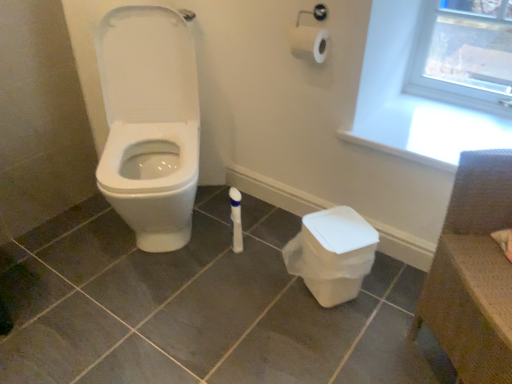
You are a GUI agent. You are given a task and a screenshot of the screen. Output one action in this format:
    pyautogui.click(x=<x>, y=<y>)
    Task: Click on the brown woven chair at upper right
    The height and width of the screenshot is (384, 512).
    Given the screenshot: What is the action you would take?
    pyautogui.click(x=473, y=273)

Measure the distance between point (331,292) and camera.

The depth of point (331,292) is 4.63 feet.

The image size is (512, 384). Describe the element at coordinates (332, 254) in the screenshot. I see `white plastic potty at lower right` at that location.

Describe the element at coordinates (464, 55) in the screenshot. I see `white plastic window frame at upper right` at that location.

The height and width of the screenshot is (384, 512). Identify the location of brown woven chair at upper right. (473, 273).

From the image's perspective, is white plastic window frame at upper right located above or below brown woven chair at upper right?

From the image's perspective, white plastic window frame at upper right appears above brown woven chair at upper right.

Measure the distance between white plastic window frame at upper right and brown woven chair at upper right.

white plastic window frame at upper right is 36.42 inches from brown woven chair at upper right.

Is white plastic window frame at upper right placed right next to brown woven chair at upper right?

No, white plastic window frame at upper right is not making contact with brown woven chair at upper right.

From a real-world perspective, is white plastic window frame at upper right beneath brown woven chair at upper right?

Actually, white plastic window frame at upper right is physically above brown woven chair at upper right in the real world.

Is point (455, 316) closer or farther from the camera than point (347, 293)?

Clearly, point (455, 316) is closer to the camera than point (347, 293).

Is brown woven chair at upper right wider or thinner than white plastic potty at lower right?

Considering their sizes, brown woven chair at upper right looks broader than white plastic potty at lower right.

Is brown woven chair at upper right spatially inside white plastic potty at lower right, or outside of it?

The correct answer is: outside.

From a real-world perspective, which is physically below, brown woven chair at upper right or white plastic potty at lower right?

From a 3D spatial view, white plastic potty at lower right is below.

Is white plastic potty at lower right facing away from white plastic window frame at upper right?

No.

How many degrees apart are the facing directions of white plastic potty at lower right and white plastic window frame at upper right?

30 degrees separate the facing orientations of white plastic potty at lower right and white plastic window frame at upper right.

At what (x,y) coordinates should I click in order to perform the action: click on window frame that appears above the white plastic potty at lower right (from a real-world perspective). Please return your answer as a coordinate pair (x, y). Looking at the image, I should click on click(x=464, y=55).

From the image's perspective, which is above, white plastic potty at lower right or white plastic window frame at upper right?

From the image's view, white plastic window frame at upper right is above.

Is brown woven chair at upper right completely or partially outside of white plastic window frame at upper right?

Yes, brown woven chair at upper right is located beyond the bounds of white plastic window frame at upper right.

This screenshot has width=512, height=384. In order to click on window frame above the brown woven chair at upper right (from the image's perspective) in this screenshot , I will do `click(464, 55)`.

Measure the distance between brown woven chair at upper right and white plastic window frame at upper right.

brown woven chair at upper right is 92.51 centimeters away from white plastic window frame at upper right.

Considering the positions of objects brown woven chair at upper right and white plastic window frame at upper right in the image provided, who is more to the left, brown woven chair at upper right or white plastic window frame at upper right?

Positioned to the left is brown woven chair at upper right.

Is white plastic window frame at upper right behind white plastic potty at lower right?

Yes, it is behind white plastic potty at lower right.

Which object is thinner, white plastic window frame at upper right or white plastic potty at lower right?

white plastic window frame at upper right is thinner.

From their relative heights in the image, would you say white plastic window frame at upper right is taller or shorter than white plastic potty at lower right?

Clearly, white plastic window frame at upper right is taller compared to white plastic potty at lower right.

Could you measure the distance between white plastic window frame at upper right and white plastic potty at lower right?

white plastic window frame at upper right and white plastic potty at lower right are 34.14 inches apart from each other.

Does point (293, 269) lie behind point (460, 256)?

That is True.

Image resolution: width=512 pixels, height=384 pixels. What are the coordinates of `potty below the brown woven chair at upper right (from a real-world perspective)` in the screenshot? It's located at (332, 254).

Looking at this image, what's the angular difference between white plastic potty at lower right and brown woven chair at upper right's facing directions?

16.4 degrees separate the facing orientations of white plastic potty at lower right and brown woven chair at upper right.

Based on the photo, between white plastic potty at lower right and brown woven chair at upper right, which one appears on the left side from the viewer's perspective?

white plastic potty at lower right is more to the left.

Where is `window frame to the right of brown woven chair at upper right`? This screenshot has width=512, height=384. window frame to the right of brown woven chair at upper right is located at coordinates (464, 55).

Where is `potty beneath the brown woven chair at upper right (from a real-world perspective)`? potty beneath the brown woven chair at upper right (from a real-world perspective) is located at coordinates (332, 254).

When comparing their distances from white plastic potty at lower right, does brown woven chair at upper right or white plastic window frame at upper right seem further?

white plastic window frame at upper right.

Based on their spatial positions, is white plastic potty at lower right or white plastic window frame at upper right closer to brown woven chair at upper right?

white plastic potty at lower right is positioned closer to the anchor brown woven chair at upper right.

From the picture: From the image, which object appears to be farther from white plastic window frame at upper right, white plastic potty at lower right or brown woven chair at upper right?

brown woven chair at upper right.

Looking at the image, which one is located further to brown woven chair at upper right, white plastic window frame at upper right or white plastic potty at lower right?

The object further to brown woven chair at upper right is white plastic window frame at upper right.

Looking at the image, which one is located further to white plastic potty at lower right, white plastic window frame at upper right or brown woven chair at upper right?

white plastic window frame at upper right.

When comparing their distances from white plastic window frame at upper right, does brown woven chair at upper right or white plastic potty at lower right seem further?

The object further to white plastic window frame at upper right is brown woven chair at upper right.

Where is `potty between brown woven chair at upper right and white plastic window frame at upper right from front to back`? This screenshot has width=512, height=384. potty between brown woven chair at upper right and white plastic window frame at upper right from front to back is located at coordinates (332, 254).